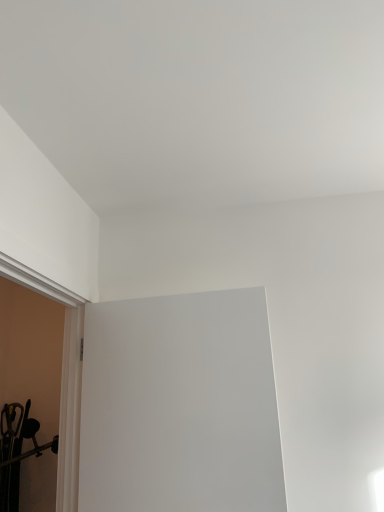
Question: From a real-world perspective, does white smooth door frame at left stand above white matte door at center?

Choices:
 (A) no
 (B) yes

Answer: (B)

Question: Does white smooth door frame at left turn towards white matte door at center?

Choices:
 (A) yes
 (B) no

Answer: (A)

Question: Considering the relative sizes of white smooth door frame at left and white matte door at center in the image provided, is white smooth door frame at left thinner than white matte door at center?

Choices:
 (A) no
 (B) yes

Answer: (A)

Question: Considering the relative sizes of white smooth door frame at left and white matte door at center in the image provided, is white smooth door frame at left shorter than white matte door at center?

Choices:
 (A) yes
 (B) no

Answer: (B)

Question: Is white smooth door frame at left completely or partially outside of white matte door at center?

Choices:
 (A) yes
 (B) no

Answer: (A)

Question: Is white smooth door frame at left positioned with its back to white matte door at center?

Choices:
 (A) no
 (B) yes

Answer: (A)

Question: Is white matte door at center bigger than white smooth door frame at left?

Choices:
 (A) yes
 (B) no

Answer: (B)

Question: Does white matte door at center turn towards white smooth door frame at left?

Choices:
 (A) yes
 (B) no

Answer: (A)

Question: Does white matte door at center lie behind white smooth door frame at left?

Choices:
 (A) yes
 (B) no

Answer: (A)

Question: From a real-world perspective, is white matte door at center positioned over white smooth door frame at left based on gravity?

Choices:
 (A) yes
 (B) no

Answer: (B)

Question: Is white matte door at center positioned with its back to white smooth door frame at left?

Choices:
 (A) no
 (B) yes

Answer: (A)

Question: Is there a large distance between white matte door at center and white smooth door frame at left?

Choices:
 (A) no
 (B) yes

Answer: (A)

Question: In terms of height, does white matte door at center look taller or shorter compared to white smooth door frame at left?

Choices:
 (A) short
 (B) tall

Answer: (A)